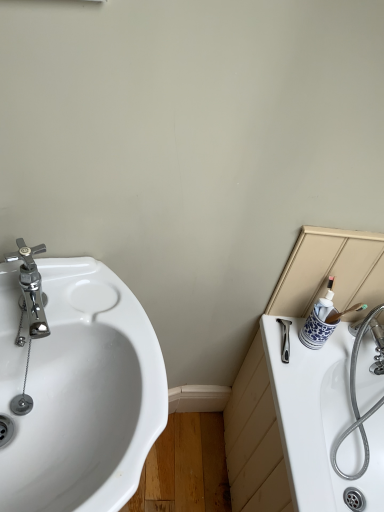
Find the location of a particular element. Image resolution: width=384 pixels, height=512 pixels. vacant space to the right of chrome/metallic faucet at left is located at coordinates (110, 330).